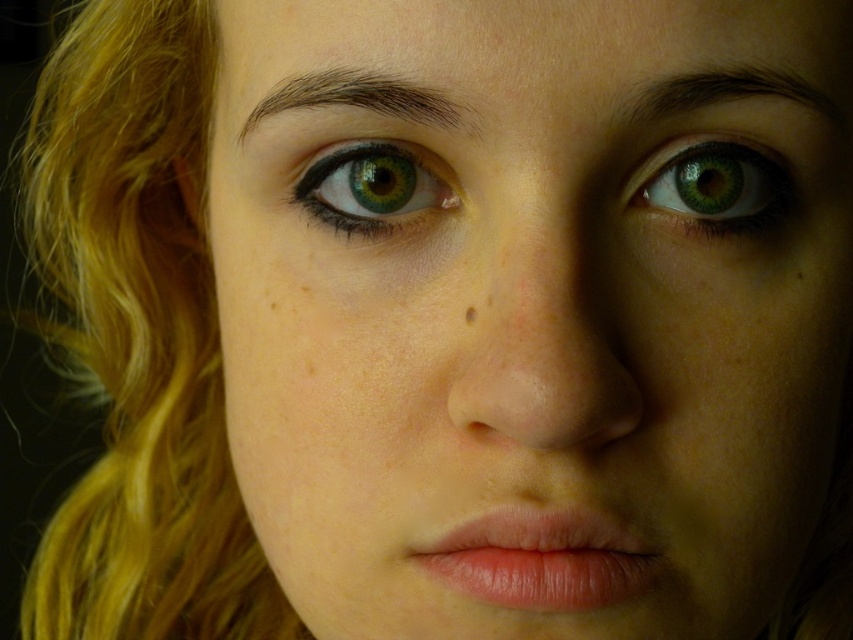
Question: Estimate the real-world distances between objects in this image. Which object is closer to the brown matte freckle at center?

Choices:
 (A) green matte eye at upper right
 (B) pink glossy lips at center
 (C) green matte eye at center
 (D) natural skin tone at center

Answer: (C)

Question: Can you confirm if natural skin tone at center is wider than brown matte freckle at center?

Choices:
 (A) no
 (B) yes

Answer: (B)

Question: Which of these objects is positioned closest to the brown matte freckle at center?

Choices:
 (A) pink glossy lips at center
 (B) natural skin tone at center

Answer: (A)

Question: Estimate the real-world distances between objects in this image. Which object is closer to the pink glossy lips at center?

Choices:
 (A) green matte eye at center
 (B) green matte eye at upper right

Answer: (A)

Question: Can you confirm if natural skin tone at center is wider than brown matte freckle at center?

Choices:
 (A) no
 (B) yes

Answer: (B)

Question: Does pink glossy lips at center come behind brown matte freckle at center?

Choices:
 (A) yes
 (B) no

Answer: (B)